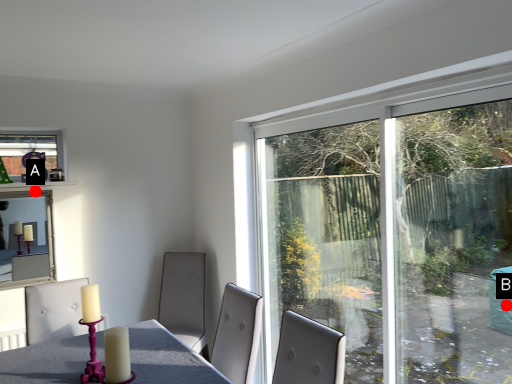
Question: Two points are circled on the image, labeled by A and B beside each circle. Which point appears farthest from the camera in this image?

Choices:
 (A) A is further
 (B) B is further

Answer: (A)